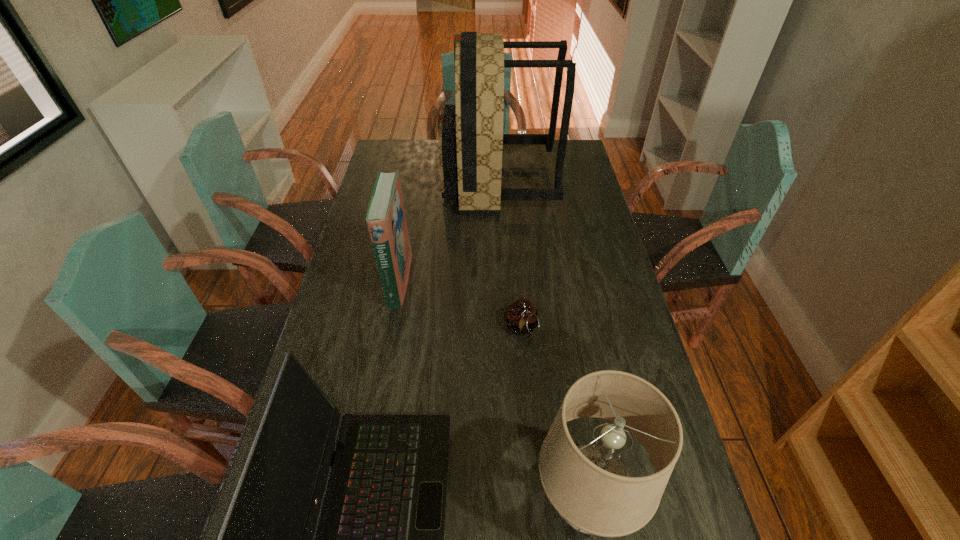
This screenshot has width=960, height=540. I want to click on vacant space that's between the third nearest object and the backpack, so click(510, 255).

Locate an element on the screen. The image size is (960, 540). object that is the closest one to the hardback book is located at coordinates (471, 139).

This screenshot has width=960, height=540. I want to click on object that ranks as the third closest to the laptop computer, so click(x=386, y=220).